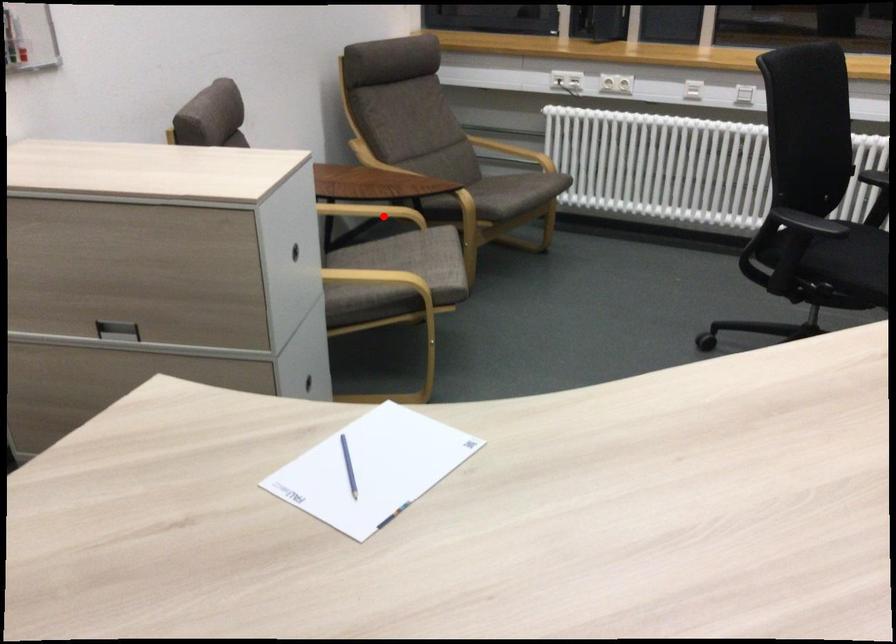
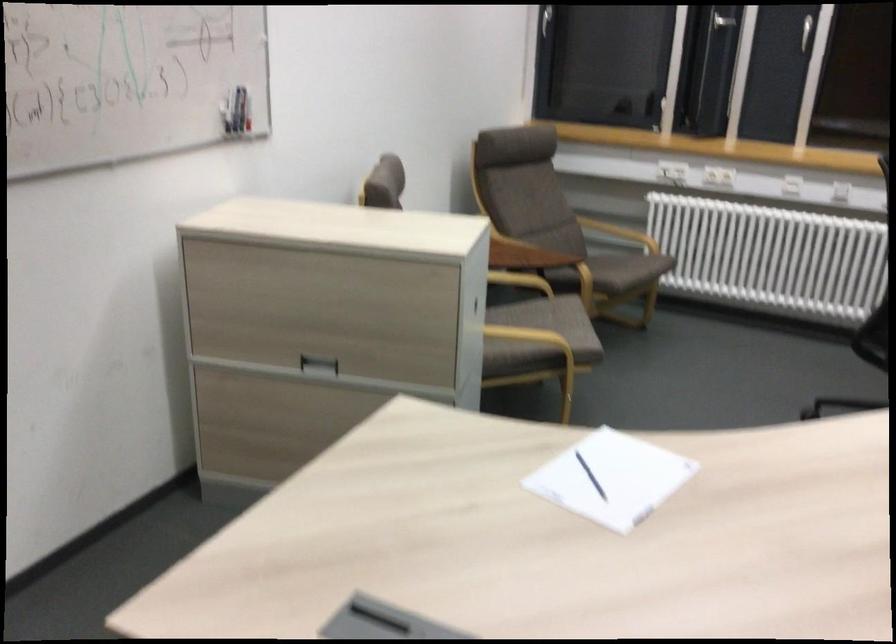
Question: I am providing you with two images of the same scene from different viewpoints. A red point is marked on the first image. At the location where the point appears in image 1, is it still visible in image 2?

Choices:
 (A) Yes
 (B) No

Answer: (A)